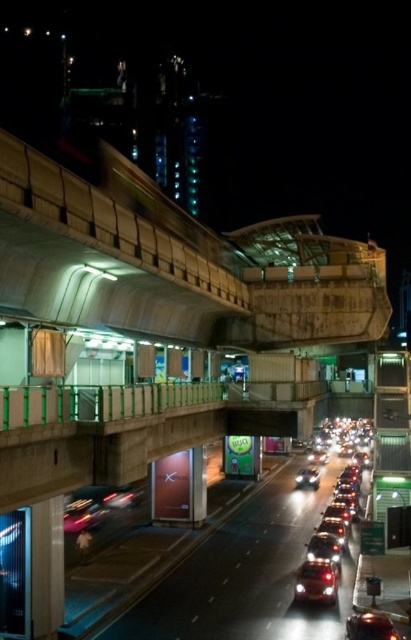
Question: Is shiny metallic car at center-right further to the viewer compared to shiny red car at center?

Choices:
 (A) no
 (B) yes

Answer: (B)

Question: Which point is closer to the camera taking this photo?

Choices:
 (A) (306, 580)
 (B) (351, 518)

Answer: (A)

Question: Can you confirm if shiny metallic car at center-right is positioned to the left of shiny red car at center?

Choices:
 (A) yes
 (B) no

Answer: (B)

Question: Which point is farther to the camera?

Choices:
 (A) shiny metallic car at center-right
 (B) shiny red car at center

Answer: (A)

Question: Is shiny metallic car at center-right above shiny red car at center?

Choices:
 (A) yes
 (B) no

Answer: (B)